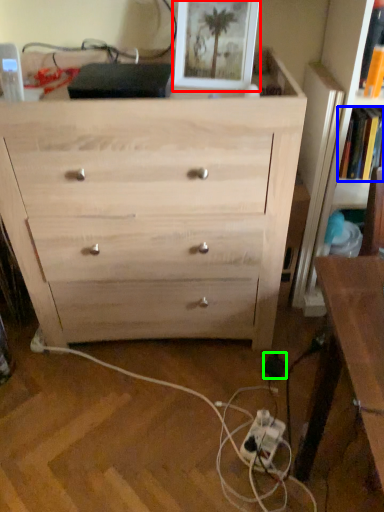
Question: Which is nearer to the picture frame (highlighted by a red box)? book (highlighted by a blue box) or electric outlet (highlighted by a green box).

Choices:
 (A) book
 (B) electric outlet

Answer: (A)